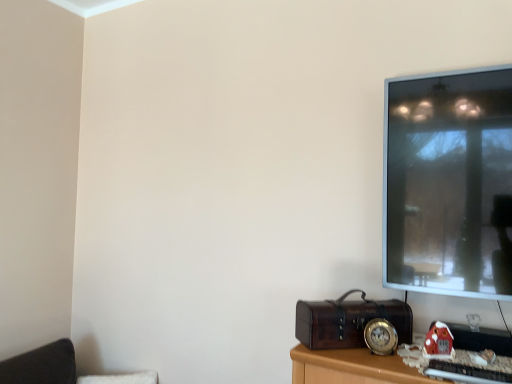
Question: Is velvet black cushion at lower left far away from matte plastic toy house at lower right?

Choices:
 (A) no
 (B) yes

Answer: (B)

Question: Can you confirm if velvet black cushion at lower left is smaller than matte plastic toy house at lower right?

Choices:
 (A) no
 (B) yes

Answer: (A)

Question: From a real-world perspective, is velvet black cushion at lower left positioned under matte plastic toy house at lower right based on gravity?

Choices:
 (A) no
 (B) yes

Answer: (B)

Question: Considering the relative positions of velvet black cushion at lower left and matte plastic toy house at lower right in the image provided, is velvet black cushion at lower left to the left of matte plastic toy house at lower right from the viewer's perspective?

Choices:
 (A) no
 (B) yes

Answer: (B)

Question: Is the depth of velvet black cushion at lower left less than that of matte plastic toy house at lower right?

Choices:
 (A) no
 (B) yes

Answer: (A)

Question: Is velvet black cushion at lower left oriented towards matte plastic toy house at lower right?

Choices:
 (A) yes
 (B) no

Answer: (B)

Question: Is matte plastic toy house at lower right outside velvet black cushion at lower left?

Choices:
 (A) no
 (B) yes

Answer: (B)

Question: From the image's perspective, is matte plastic toy house at lower right above velvet black cushion at lower left?

Choices:
 (A) yes
 (B) no

Answer: (A)

Question: Is matte plastic toy house at lower right aimed at velvet black cushion at lower left?

Choices:
 (A) no
 (B) yes

Answer: (A)

Question: Considering the relative sizes of matte plastic toy house at lower right and velvet black cushion at lower left in the image provided, is matte plastic toy house at lower right thinner than velvet black cushion at lower left?

Choices:
 (A) no
 (B) yes

Answer: (B)

Question: Does matte plastic toy house at lower right appear on the right side of velvet black cushion at lower left?

Choices:
 (A) no
 (B) yes

Answer: (B)

Question: From a real-world perspective, does matte plastic toy house at lower right stand above velvet black cushion at lower left?

Choices:
 (A) no
 (B) yes

Answer: (B)

Question: From a real-world perspective, is matte plastic toy house at lower right physically located above or below velvet black cushion at lower left?

Choices:
 (A) below
 (B) above

Answer: (B)